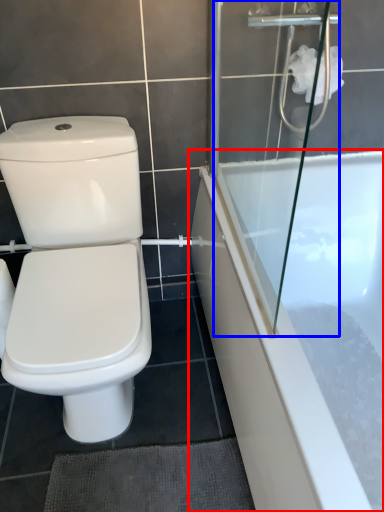
Question: Which of the following is the closest to the observer, bathtub (highlighted by a red box) or shower door (highlighted by a blue box)?

Choices:
 (A) bathtub
 (B) shower door

Answer: (B)